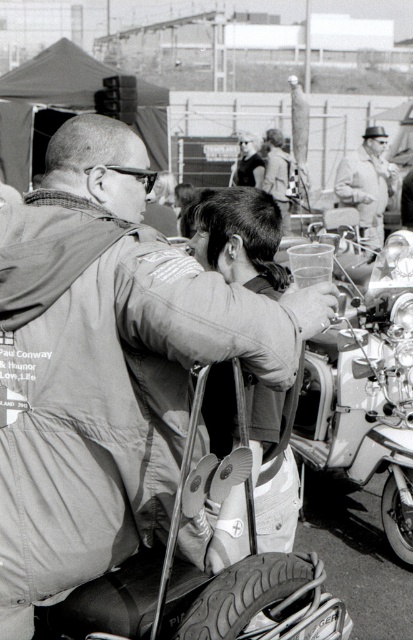
Does metallic chrome motorcycle at center appear on the right side of rubber/soft tire at lower right?

Incorrect, metallic chrome motorcycle at center is not on the right side of rubber/soft tire at lower right.

Between point (318, 442) and point (406, 492), which one is positioned in front?

Point (406, 492) is more forward.

Which is behind, point (348, 452) or point (403, 472)?

The point (348, 452) is more distant.

Find the location of a particular element. Image resolution: width=413 pixels, height=640 pixels. metallic chrome motorcycle at center is located at coordinates (368, 396).

Is point (405, 428) closer to viewer compared to point (220, 580)?

No.

Between metallic chrome motorcycle at center and rubber/textured tire at lower center, which one is positioned higher?

metallic chrome motorcycle at center is higher up.

Describe the element at coordinates (368, 396) in the screenshot. I see `metallic chrome motorcycle at center` at that location.

The height and width of the screenshot is (640, 413). Find the location of `metallic chrome motorcycle at center`. metallic chrome motorcycle at center is located at coordinates (368, 396).

Is smooth beige jacket at center shorter than rubber/soft tire at lower right?

In fact, smooth beige jacket at center may be taller than rubber/soft tire at lower right.

This screenshot has height=640, width=413. What do you see at coordinates (367, 182) in the screenshot?
I see `smooth beige jacket at center` at bounding box center [367, 182].

Between point (360, 145) and point (398, 502), which one is positioned in front?

Point (398, 502) is in front.

Where is `smooth beige jacket at center`? The height and width of the screenshot is (640, 413). smooth beige jacket at center is located at coordinates (367, 182).